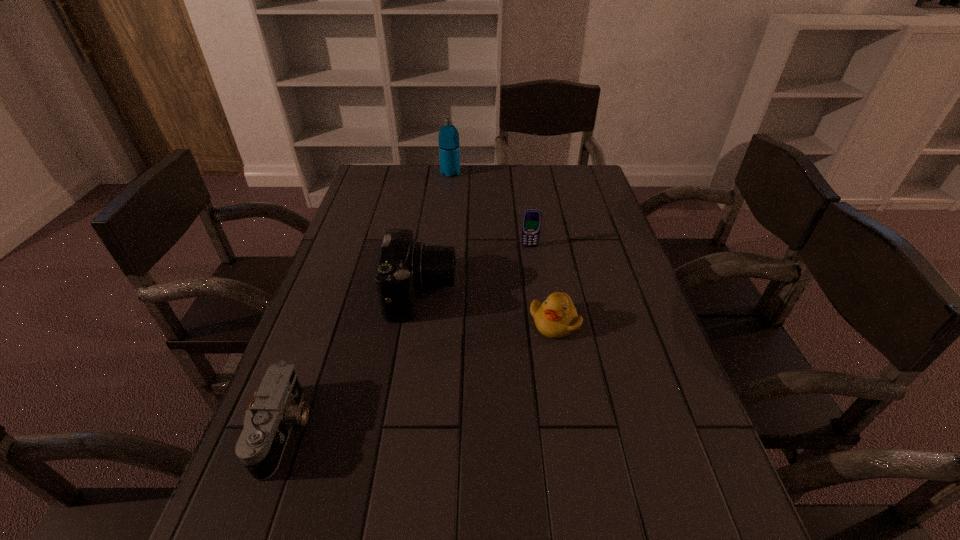
Locate an element on the screen. The width and height of the screenshot is (960, 540). free area in between the third shortest object and the nearer camera is located at coordinates (407, 338).

At what (x,y) coordinates should I click in order to perform the action: click on blank region between the thermos bottle and the taller camera. Please return your answer as a coordinate pair (x, y). This screenshot has height=540, width=960. Looking at the image, I should click on (436, 233).

Find the location of a particular element. The width and height of the screenshot is (960, 540). free space between the duckling and the cellular telephone is located at coordinates (541, 285).

The width and height of the screenshot is (960, 540). What are the coordinates of `free space between the cellular telephone and the farthest object` in the screenshot? It's located at (490, 210).

Where is `free space between the thermos bottle and the taller camera`? This screenshot has width=960, height=540. free space between the thermos bottle and the taller camera is located at coordinates (436, 233).

This screenshot has width=960, height=540. Find the location of `vacant space in between the farther camera and the cellular telephone`. vacant space in between the farther camera and the cellular telephone is located at coordinates (475, 270).

The height and width of the screenshot is (540, 960). Find the location of `free space between the duckling and the farther camera`. free space between the duckling and the farther camera is located at coordinates (488, 308).

The height and width of the screenshot is (540, 960). What are the coordinates of `free space between the thermos bottle and the duckling` in the screenshot? It's located at (502, 248).

Where is `vacant area that lies between the nearer camera and the right camera`? The image size is (960, 540). vacant area that lies between the nearer camera and the right camera is located at coordinates (353, 362).

This screenshot has height=540, width=960. Identify the location of free space between the cellular telephone and the right camera. (475, 270).